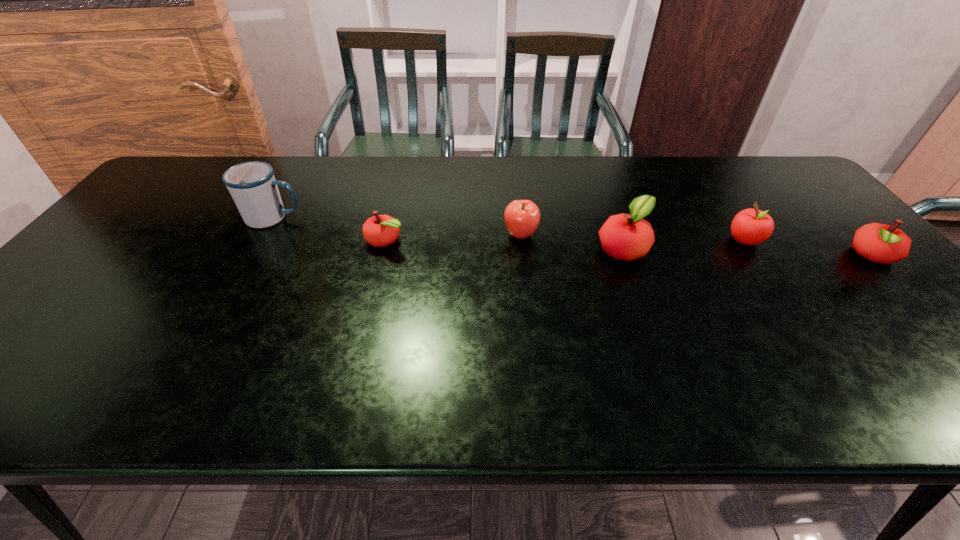
Find the location of `vacant region at the near left corner of the desktop`. vacant region at the near left corner of the desktop is located at coordinates (50, 352).

In order to click on free area in between the third object from right to left and the fourth apple from left to right in this screenshot , I will do `click(684, 244)`.

Locate an element on the screen. The image size is (960, 540). free space between the second shortest object and the fourth object from right to left is located at coordinates [x=696, y=245].

Where is `unoccupied position between the fourth object from right to left and the third object from right to left`? The image size is (960, 540). unoccupied position between the fourth object from right to left and the third object from right to left is located at coordinates (572, 241).

Locate an element on the screen. The height and width of the screenshot is (540, 960). vacant space that's between the leftmost apple and the third object from left to right is located at coordinates (453, 238).

Find the location of a particular element. free spot between the fifth object from left to right and the leftmost apple is located at coordinates (564, 240).

The height and width of the screenshot is (540, 960). What are the coordinates of `free space that is in between the third apple from left to right and the second object from right to left` in the screenshot? It's located at (684, 244).

The width and height of the screenshot is (960, 540). Identify the location of free space between the tallest object and the third apple from left to right. (448, 233).

At what (x,y) coordinates should I click in order to perform the action: click on free spot between the tallest object and the shortest apple. Please return your answer as a coordinate pair (x, y). Looking at the image, I should click on (329, 229).

Where is `object that is the fifth nearest to the second apple from left to right`? object that is the fifth nearest to the second apple from left to right is located at coordinates (881, 243).